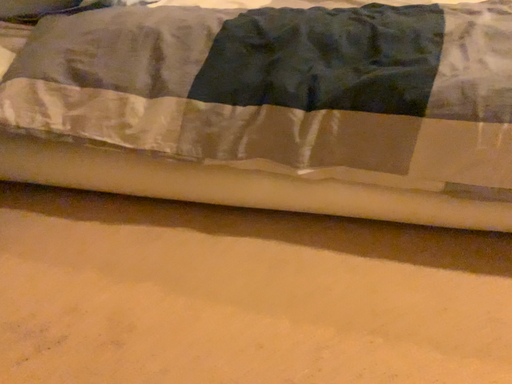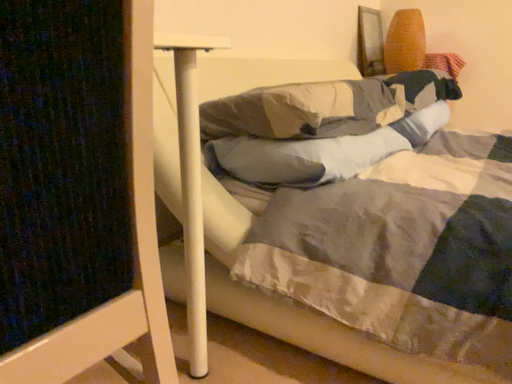
Question: Which way did the camera rotate in the video?

Choices:
 (A) rotated downward
 (B) rotated upward

Answer: (B)